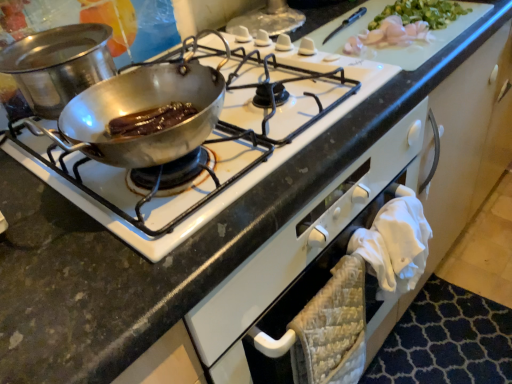
The height and width of the screenshot is (384, 512). I want to click on shiny metal pan at upper left, so click(x=193, y=145).

The image size is (512, 384). Describe the element at coordinates (193, 145) in the screenshot. I see `shiny metal pan at upper left` at that location.

Describe the element at coordinates (58, 65) in the screenshot. This screenshot has width=512, height=384. I see `shiny silver pan at upper left` at that location.

The image size is (512, 384). In order to click on shiny silver pan at upper left in this screenshot , I will do `click(58, 65)`.

Where is `shiny metal pan at upper left`? shiny metal pan at upper left is located at coordinates (193, 145).

Between shiny metal pan at upper left and shiny silver pan at upper left, which one appears on the right side from the viewer's perspective?

shiny metal pan at upper left is more to the right.

Is shiny metal pan at upper left further to the viewer compared to shiny silver pan at upper left?

That is False.

Which is less distant, (324,103) or (36,57)?

Point (324,103).

From the image's perspective, which one is positioned higher, shiny metal pan at upper left or shiny silver pan at upper left?

shiny silver pan at upper left is shown above in the image.

From a real-world perspective, between shiny metal pan at upper left and shiny silver pan at upper left, who is vertically higher?

shiny silver pan at upper left, from a real-world perspective.

Which of these two, shiny metal pan at upper left or shiny silver pan at upper left, is thinner?

shiny silver pan at upper left is thinner.

Considering the sizes of objects shiny metal pan at upper left and shiny silver pan at upper left in the image provided, who is shorter, shiny metal pan at upper left or shiny silver pan at upper left?

Standing shorter between the two is shiny metal pan at upper left.

Between shiny metal pan at upper left and shiny silver pan at upper left, which one has smaller size?

With smaller size is shiny silver pan at upper left.

Is shiny metal pan at upper left situated inside shiny silver pan at upper left or outside?

shiny metal pan at upper left cannot be found inside shiny silver pan at upper left.

Is shiny metal pan at upper left positioned far away from shiny silver pan at upper left?

No, shiny metal pan at upper left is in close proximity to shiny silver pan at upper left.

Is shiny metal pan at upper left facing away from shiny silver pan at upper left?

No.

Can you tell me how much shiny metal pan at upper left and shiny silver pan at upper left differ in facing direction?

shiny metal pan at upper left and shiny silver pan at upper left are facing 3.06 degrees away from each other.

Where is `kitchen appliance behind the shiny metal pan at upper left`? The height and width of the screenshot is (384, 512). kitchen appliance behind the shiny metal pan at upper left is located at coordinates (58, 65).

Considering the relative positions of shiny silver pan at upper left and shiny metal pan at upper left in the image provided, is shiny silver pan at upper left to the left of shiny metal pan at upper left from the viewer's perspective?

Correct, you'll find shiny silver pan at upper left to the left of shiny metal pan at upper left.

Is shiny silver pan at upper left positioned in front of shiny metal pan at upper left?

No, shiny silver pan at upper left is behind shiny metal pan at upper left.

Based on the photo, which is closer, (11, 59) or (200, 191)?

The point (200, 191) is more forward.

From the picture: From the image's perspective, does shiny silver pan at upper left appear lower than shiny metal pan at upper left?

No.

From a real-world perspective, is shiny silver pan at upper left located higher than shiny metal pan at upper left?

Yes, from a real-world perspective, shiny silver pan at upper left is above shiny metal pan at upper left.

Considering the sizes of shiny silver pan at upper left and shiny metal pan at upper left in the image, is shiny silver pan at upper left wider or thinner than shiny metal pan at upper left?

shiny silver pan at upper left is thinner than shiny metal pan at upper left.

From their relative heights in the image, would you say shiny silver pan at upper left is taller or shorter than shiny metal pan at upper left?

shiny silver pan at upper left is taller than shiny metal pan at upper left.

Who is smaller, shiny silver pan at upper left or shiny metal pan at upper left?

With smaller size is shiny silver pan at upper left.

Do you think shiny silver pan at upper left is within shiny metal pan at upper left, or outside of it?

shiny silver pan at upper left is located beyond the bounds of shiny metal pan at upper left.

Is there a large distance between shiny silver pan at upper left and shiny metal pan at upper left?

shiny silver pan at upper left is near shiny metal pan at upper left, not far away.

Is shiny silver pan at upper left facing away from shiny metal pan at upper left?

That's not correct — shiny silver pan at upper left is not looking away from shiny metal pan at upper left.

What are the coordinates of `gas stove below the shiny silver pan at upper left (from the image's perspective)` in the screenshot? It's located at (193, 145).

Locate an element on the screen. This screenshot has height=384, width=512. kitchen appliance on the left of shiny metal pan at upper left is located at coordinates (58, 65).

Where is `gas stove below the shiny silver pan at upper left (from the image's perspective)`? This screenshot has height=384, width=512. gas stove below the shiny silver pan at upper left (from the image's perspective) is located at coordinates (193, 145).